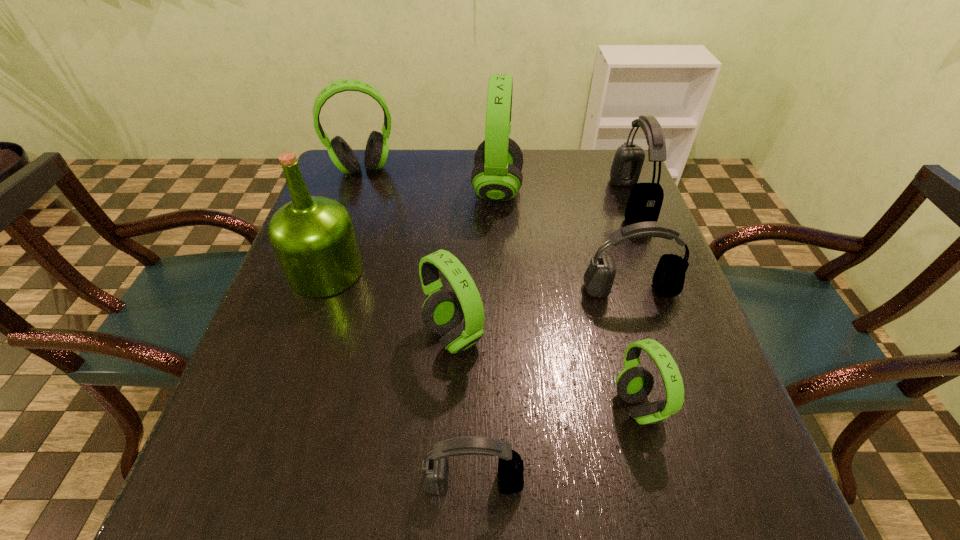
This screenshot has width=960, height=540. I want to click on vacant area at the right edge of the desktop, so click(632, 254).

Where is `free area in between the third nearest headset and the biggest green headset`? The height and width of the screenshot is (540, 960). free area in between the third nearest headset and the biggest green headset is located at coordinates (475, 263).

Where is `vacant point located between the farthest black headset and the biggest green headset`? vacant point located between the farthest black headset and the biggest green headset is located at coordinates pos(564,196).

The height and width of the screenshot is (540, 960). I want to click on vacant space that's between the nearest object and the smallest green headset, so click(556, 444).

Image resolution: width=960 pixels, height=540 pixels. I want to click on free space between the second biggest black headset and the biggest green headset, so click(x=564, y=240).

At what (x,y) coordinates should I click in order to perform the action: click on free space between the third biggest green headset and the rightmost green headset. Please return your answer as a coordinate pair (x, y). The image size is (960, 540). Looking at the image, I should click on (545, 371).

The height and width of the screenshot is (540, 960). Identify the location of empty location between the biggest green headset and the olive oil. (412, 231).

Locate an element on the screen. The height and width of the screenshot is (540, 960). vacant area that lies between the biggest black headset and the tallest headset is located at coordinates (564, 196).

This screenshot has width=960, height=540. I want to click on vacant space that's between the nearest green headset and the smallest black headset, so tap(556, 444).

The height and width of the screenshot is (540, 960). In order to click on vacant area that lies between the second nearest object and the third biggest green headset in this screenshot , I will do `click(545, 371)`.